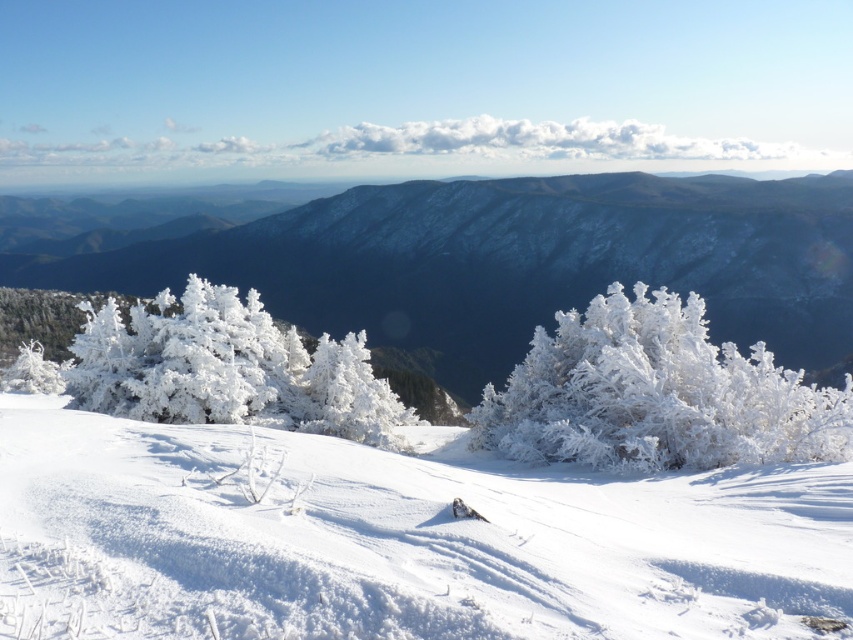
Question: Can you confirm if white frosty snow at center is bigger than frosted white bush at center?

Choices:
 (A) yes
 (B) no

Answer: (A)

Question: Which object is closer to the camera taking this photo?

Choices:
 (A) frosted white trees at left
 (B) frosted white bush at center
 (C) frosted white trees at center
 (D) white frosty snow at center

Answer: (D)

Question: Does frosted white trees at center appear under frosted white bush at center?

Choices:
 (A) no
 (B) yes

Answer: (A)

Question: Which point is closer to the camera taking this photo?

Choices:
 (A) [160, 312]
 (B) [544, 339]

Answer: (A)

Question: Among these points, which one is nearest to the camera?

Choices:
 (A) (253, 317)
 (B) (616, 442)
 (C) (492, 204)
 (D) (738, 502)

Answer: (D)

Question: Can you confirm if white frosty snow at center is positioned to the right of frosted white trees at center?

Choices:
 (A) no
 (B) yes

Answer: (A)